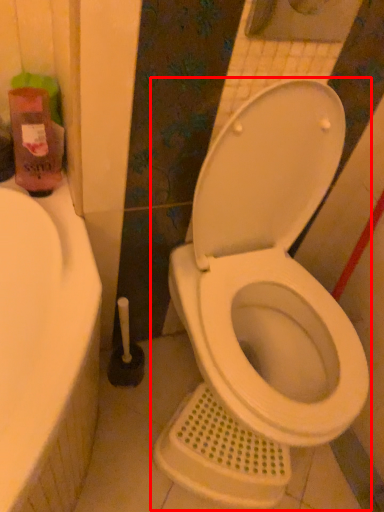
Question: From the image's perspective, what is the correct spatial relationship of toilet (annotated by the red box) in relation to cleaning product?

Choices:
 (A) above
 (B) below

Answer: (B)